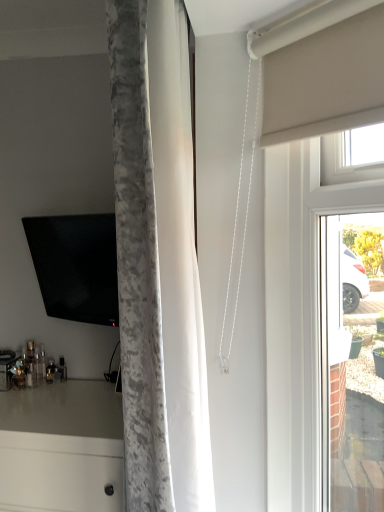
Question: From a real-world perspective, is matte black tv at left physically located above or below matte white glass door at right?

Choices:
 (A) below
 (B) above

Answer: (B)

Question: Considering the positions of point (46, 276) and point (274, 436), is point (46, 276) closer or farther from the camera than point (274, 436)?

Choices:
 (A) farther
 (B) closer

Answer: (A)

Question: Based on their relative distances, which object is farther from the matte white glass door at right?

Choices:
 (A) white glossy countertop at lower left
 (B) matte black tv at left

Answer: (B)

Question: Based on their relative distances, which object is nearer to the white glossy countertop at lower left?

Choices:
 (A) matte black tv at left
 (B) matte white glass door at right

Answer: (A)